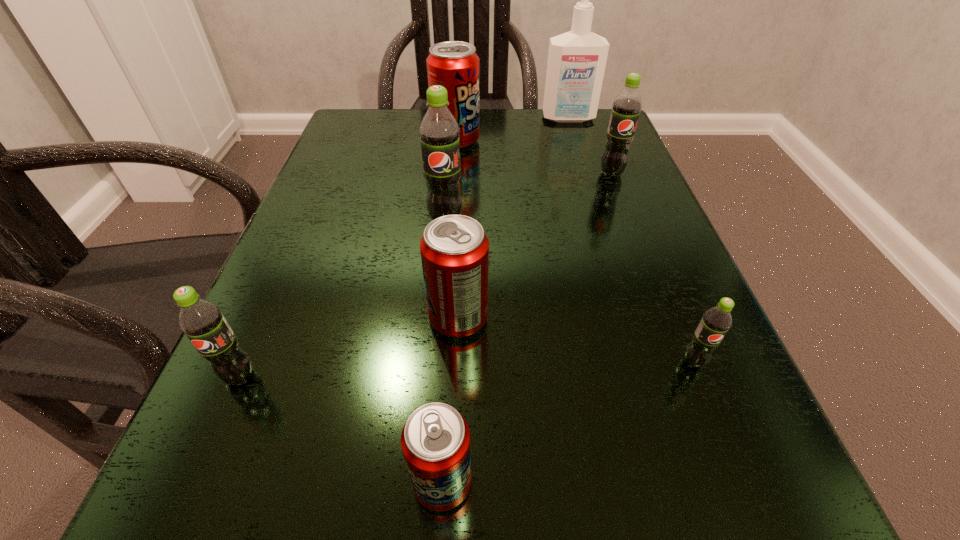
The height and width of the screenshot is (540, 960). I want to click on free space located 0.300m on the back of the fourth farthest soda can, so click(465, 184).

At what (x,y) coordinates should I click in order to perform the action: click on free space located 0.160m on the front label of the smallest green soda. Please return your answer as a coordinate pair (x, y). This screenshot has height=540, width=960. Looking at the image, I should click on (753, 508).

This screenshot has height=540, width=960. In order to click on free location located 0.280m on the right of the smallest red soda can in this screenshot , I will do `click(738, 482)`.

Identify the location of cleansing agent at the far edge. The image size is (960, 540). (576, 64).

What are the coordinates of `soda can that is at the far edge` in the screenshot? It's located at (454, 65).

At what (x,y) coordinates should I click in order to perform the action: click on object that is positioned at the near edge. Please return your answer as a coordinate pair (x, y). This screenshot has height=540, width=960. Looking at the image, I should click on (435, 440).

You are a GUI agent. You are given a task and a screenshot of the screen. Output one action in this format:
    pyautogui.click(x=<x>, y=<y>)
    Task: Click on the object that is positioned at the left edge
    This screenshot has height=540, width=960.
    Given the screenshot: What is the action you would take?
    pyautogui.click(x=202, y=321)

In order to click on cleansing agent located in the right edge section of the desktop in this screenshot , I will do `click(576, 64)`.

Where is `object located at the far right corner`? This screenshot has height=540, width=960. object located at the far right corner is located at coordinates (576, 64).

Identify the location of vacant space at the far edge of the desktop. Image resolution: width=960 pixels, height=540 pixels. (420, 108).